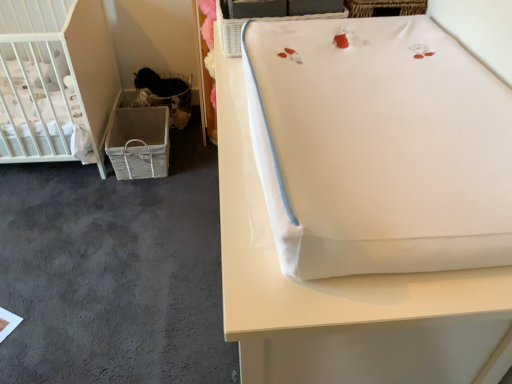
Question: From their relative heights in the image, would you say white fabric changing pad at upper right is taller or shorter than white wicker basket at upper center, the first basket viewed from the right?

Choices:
 (A) short
 (B) tall

Answer: (B)

Question: Is point (457, 289) positioned closer to the camera than point (224, 21)?

Choices:
 (A) farther
 (B) closer

Answer: (B)

Question: Which object is positioned closest to the white matte crib at left?

Choices:
 (A) white fabric changing pad at upper right
 (B) gray carpet at lower left
 (C) woven fabric basket at lower left
 (D) white wicker basket at upper center, arranged as the second basket when viewed from the left
 (E) woven fabric basket at lower left, arranged as the 1th basket when viewed from the left

Answer: (C)

Question: Considering the real-world distances, which object is farthest from the white fabric changing pad at upper right?

Choices:
 (A) white wicker basket at upper center, arranged as the second basket when viewed from the left
 (B) gray carpet at lower left
 (C) white matte crib at left
 (D) woven fabric basket at lower left, the 2th basket viewed from the right
 (E) woven fabric basket at lower left

Answer: (D)